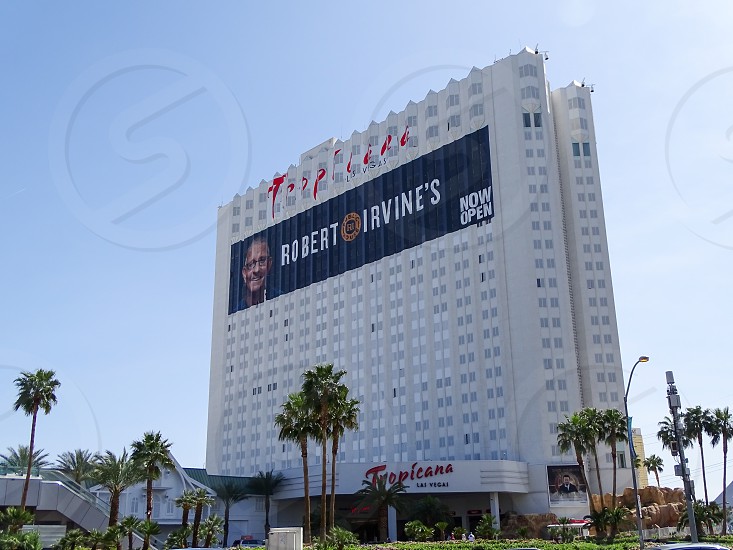
Locate an element on the screen. The height and width of the screenshot is (550, 733). side of staircase is located at coordinates (95, 518), (73, 500).